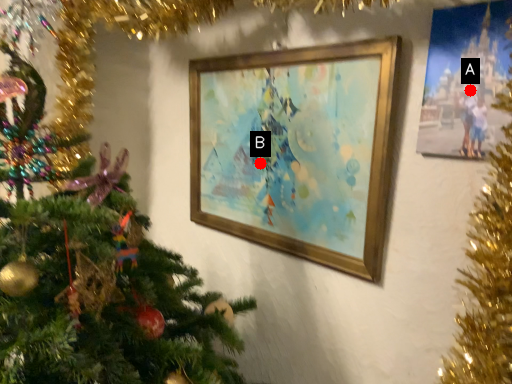
Question: Two points are circled on the image, labeled by A and B beside each circle. Among these points, which one is farthest from the camera?

Choices:
 (A) A is further
 (B) B is further

Answer: (B)